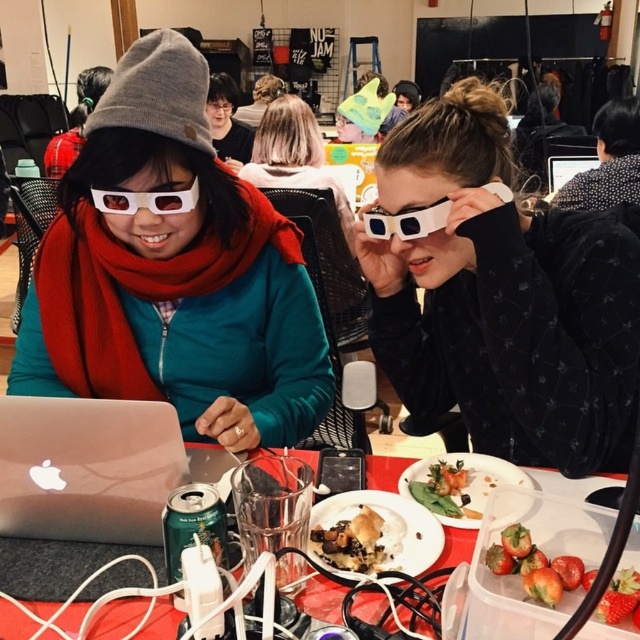
Question: Can you confirm if white matte glasses at center is wider than silver metallic laptop at upper center?

Choices:
 (A) yes
 (B) no

Answer: (A)

Question: Among these points, which one is farthest from the camera?

Choices:
 (A) (467, 472)
 (B) (365, 221)
 (C) (502, 369)
 (D) (340, 220)

Answer: (D)

Question: Does translucent glass plate at center appear on the left side of shiny golden plate at center?

Choices:
 (A) yes
 (B) no

Answer: (A)

Question: Which point is farther to the camera?

Choices:
 (A) (435, 204)
 (B) (257, 132)

Answer: (B)

Question: Can you confirm if shiny red strawberries at lower right is bigger than golden crispy pastry at center?

Choices:
 (A) yes
 (B) no

Answer: (A)

Question: Which point appears farthest from the camera in this image?

Choices:
 (A) (440, 205)
 (B) (218, 244)
 (C) (157, 209)
 (D) (220, 76)

Answer: (D)